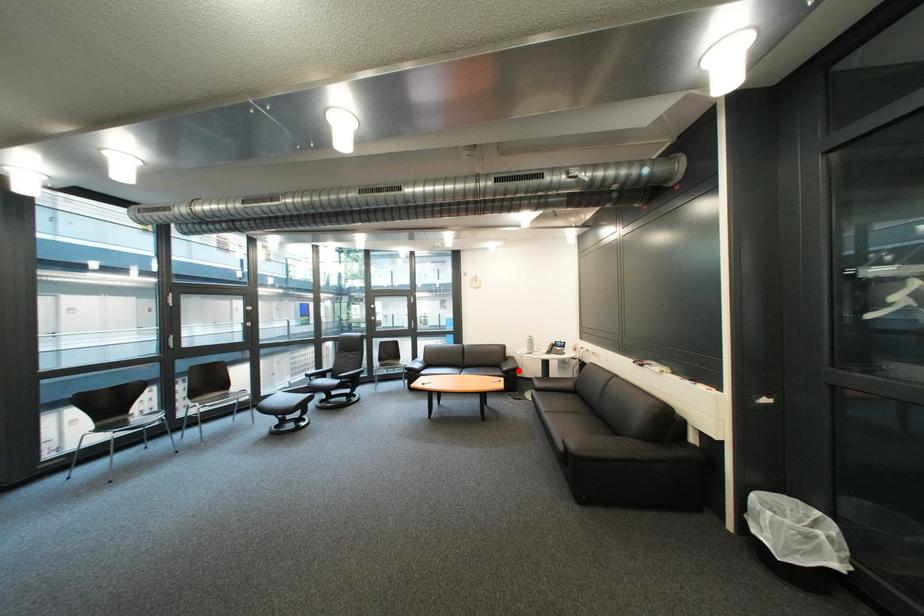
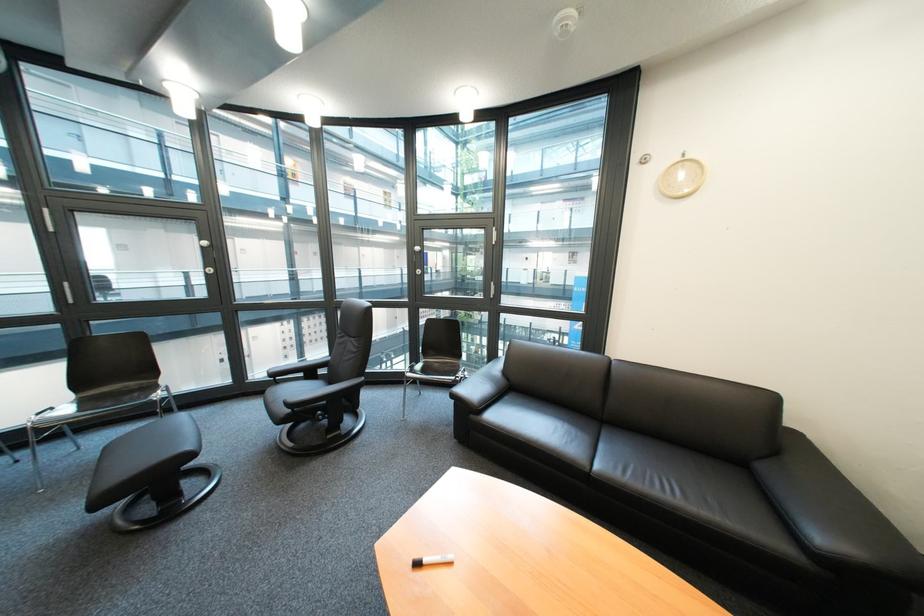
Question: A red point is marked in image1. In image2, is the corresponding 3D point closer to the camera or farther? Reply with the corresponding letter.

Choices:
 (A) The corresponding 3D point is closer.
 (B) The corresponding 3D point is farther.

Answer: (A)